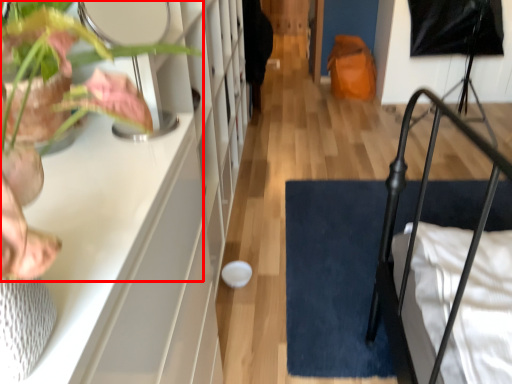
Question: In this image, where is houseplant (annotated by the red box) located relative to doormat?

Choices:
 (A) left
 (B) right

Answer: (A)